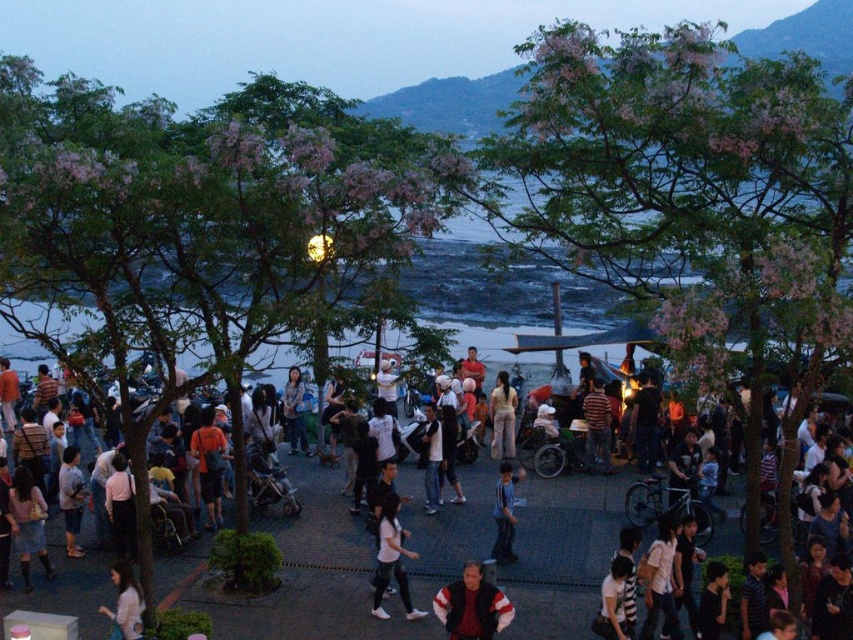
Question: Can you confirm if green leafy tree at center is wider than white cotton shirt at center?

Choices:
 (A) no
 (B) yes

Answer: (A)

Question: Which of the following is the closest to the observer?

Choices:
 (A) (843, 326)
 (B) (316, 257)
 (C) (73, 456)

Answer: (A)

Question: Which of the following is the farthest from the observer?

Choices:
 (A) (500, 376)
 (B) (451, 637)
 (C) (683, 44)
 (D) (511, 548)

Answer: (A)

Question: Is green leafy tree at center to the right of blue denim jeans at center from the viewer's perspective?

Choices:
 (A) no
 (B) yes

Answer: (A)

Question: Is green leafy tree at center above red and white jacket at center?

Choices:
 (A) yes
 (B) no

Answer: (A)

Question: Which object is positioned farthest from the light blue denim jeans at lower left?

Choices:
 (A) light pink fabric at lower left
 (B) white matte shirt at center
 (C) light beige pants at center

Answer: (C)